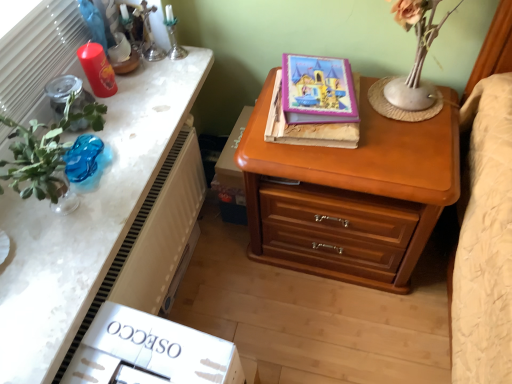
Identify the location of free space above wooden nightstand at upper center (from a real-world perspective). (87, 178).